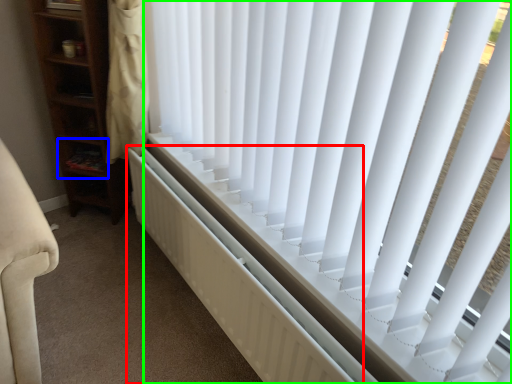
Question: Considering the real-world distances, which object is closest to radiator (highlighted by a red box)? shelf (highlighted by a blue box) or window blind (highlighted by a green box).

Choices:
 (A) shelf
 (B) window blind

Answer: (B)